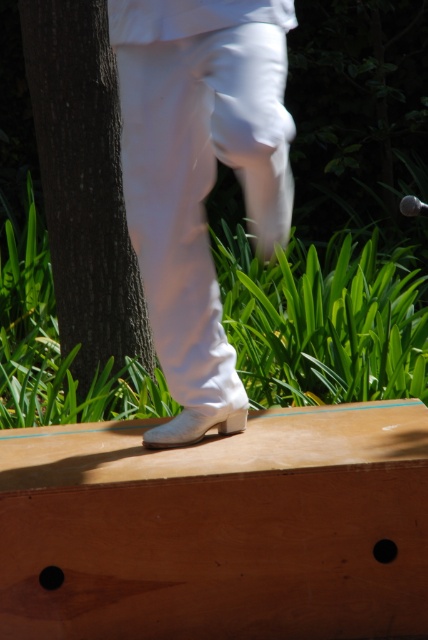
How far apart are white leather boot at center and brown rough bark at left?

white leather boot at center and brown rough bark at left are 5.01 feet apart from each other.

Which of these two, white leather boot at center or brown rough bark at left, stands taller?

brown rough bark at left

Who is more forward, (x=204, y=163) or (x=79, y=300)?

Point (x=204, y=163)

Find the location of a particular element. The height and width of the screenshot is (640, 428). white leather boot at center is located at coordinates (199, 177).

Who is more forward, (x=48, y=173) or (x=406, y=195)?

Point (x=48, y=173)

Where is `brown rough bark at left`? brown rough bark at left is located at coordinates (83, 184).

Can you confirm if white leather boot at center is wider than metallic silver microphone at center?

Correct, the width of white leather boot at center exceeds that of metallic silver microphone at center.

What do you see at coordinates (199, 177) in the screenshot? I see `white leather boot at center` at bounding box center [199, 177].

Image resolution: width=428 pixels, height=640 pixels. I want to click on white leather boot at center, so click(x=199, y=177).